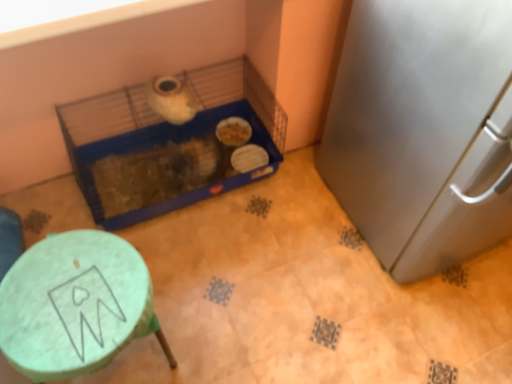
The width and height of the screenshot is (512, 384). Find the location of `empty space that is in between satin silver refrigerator at right and blue plastic bird cage at center`. empty space that is in between satin silver refrigerator at right and blue plastic bird cage at center is located at coordinates (278, 243).